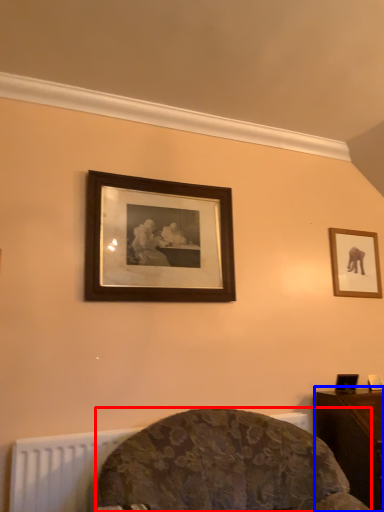
Question: Which of the following is the closest to the observer, furniture (highlighted by a red box) or table (highlighted by a blue box)?

Choices:
 (A) furniture
 (B) table

Answer: (A)